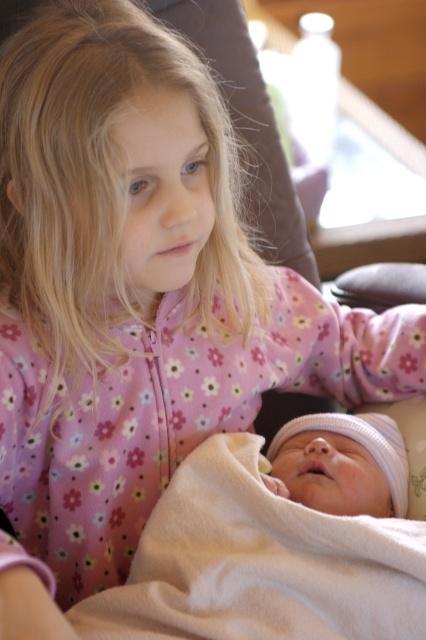
You are a parent trying to choose between two blankets for your baby. The scene shows a white fleece blanket at lower center and a soft white blanket at center. Which one is larger?

The white fleece blanket at lower center is bigger than the soft white blanket at center.

You are a photographer who wants to capture the children in the image without the white fleece blanket at lower center being visible in the frame. What action should you take?

Move the camera to the left so that the white fleece blanket at lower center is no longer in the frame.